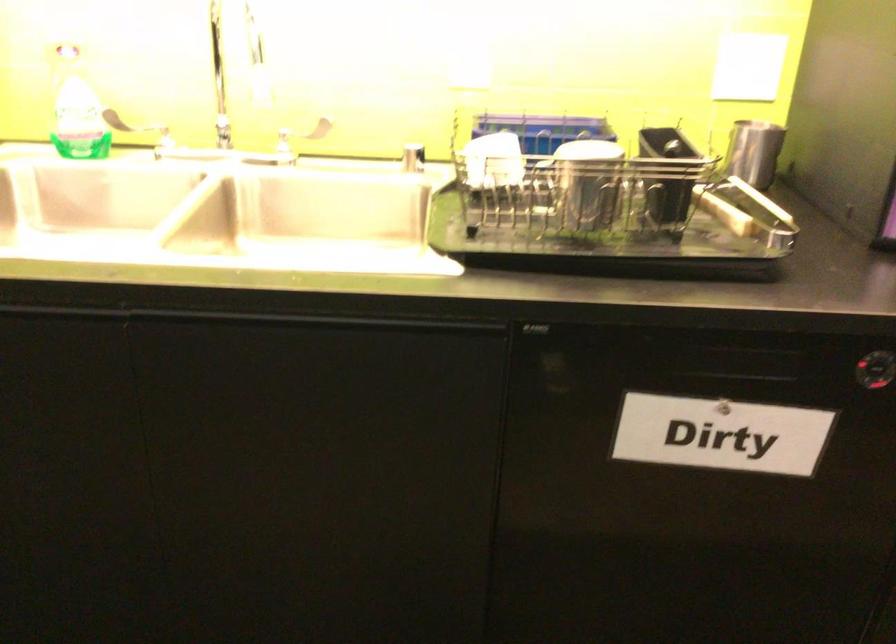
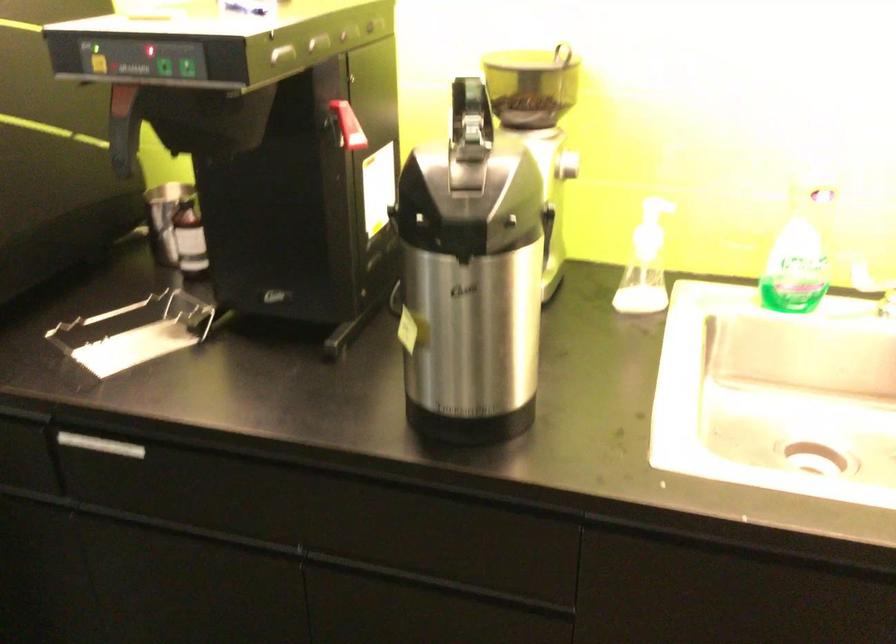
Question: The camera is either moving clockwise (left) or counter-clockwise (right) around the object. The first image is from the beginning of the video and the second image is from the end. Is the camera moving left or right when shooting the video?

Choices:
 (A) Left
 (B) Right

Answer: (B)